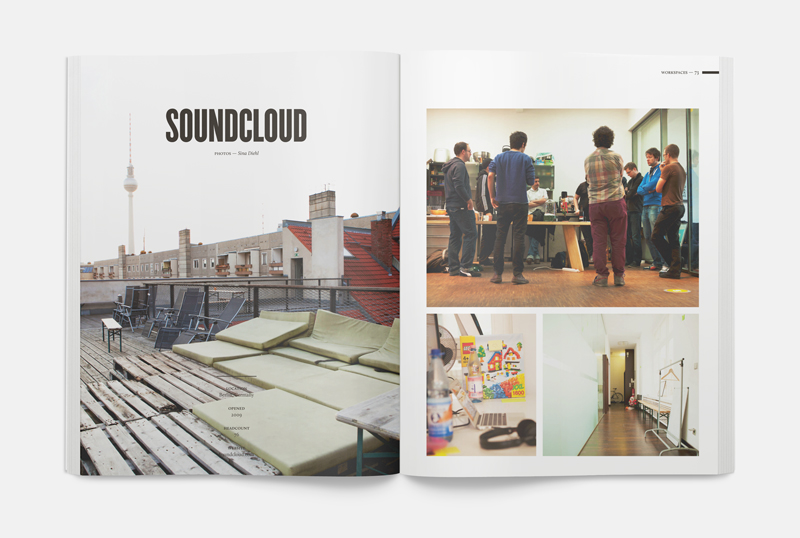
Image resolution: width=800 pixels, height=538 pixels. In order to click on floor in this screenshot , I will do `click(562, 282)`.